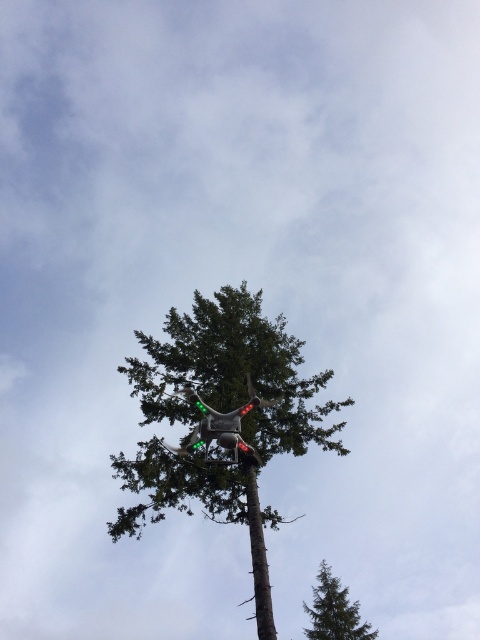
Question: Which point is farther to the camera?

Choices:
 (A) (154, 436)
 (B) (328, 637)

Answer: (B)

Question: Can you confirm if green matte drone at center is positioned to the left of green matte tree at center?

Choices:
 (A) yes
 (B) no

Answer: (A)

Question: Can you confirm if green matte drone at center is bigger than green matte tree at center?

Choices:
 (A) yes
 (B) no

Answer: (A)

Question: Which point is farther from the camera taking this photo?

Choices:
 (A) (327, 589)
 (B) (218, 490)

Answer: (A)

Question: Which point appears farthest from the camera in this image?

Choices:
 (A) (320, 588)
 (B) (239, 285)

Answer: (A)

Question: Is green matte drone at center closer to the viewer compared to green matte tree at center?

Choices:
 (A) yes
 (B) no

Answer: (A)